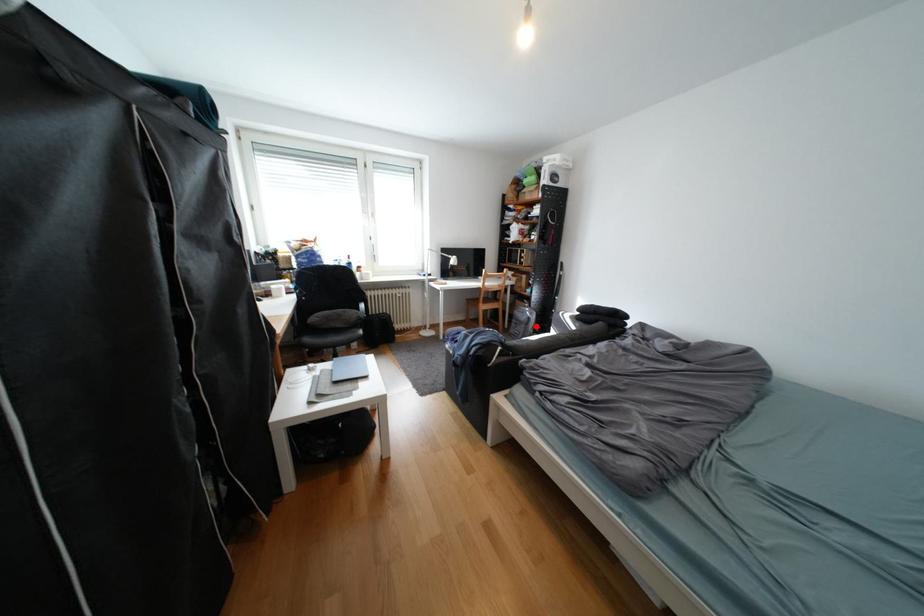
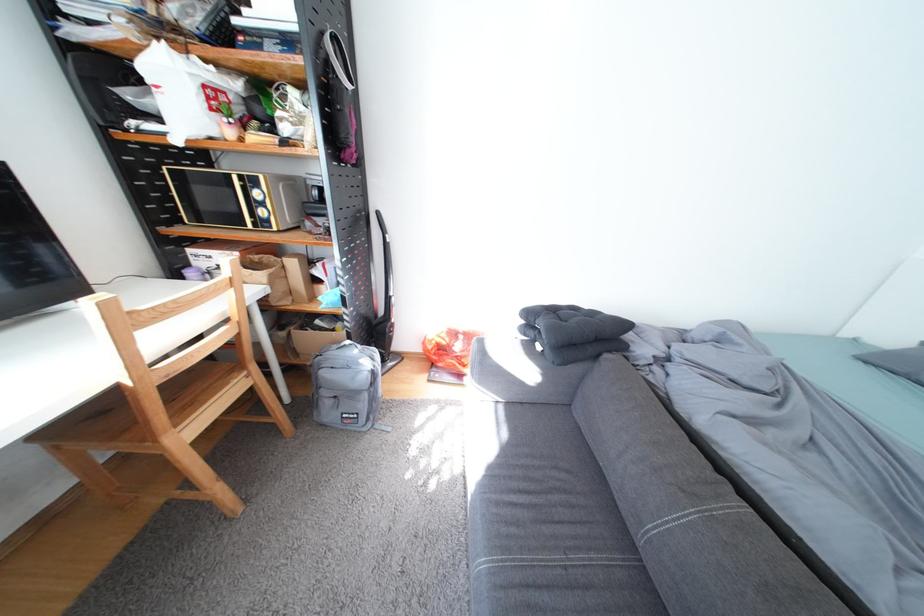
Question: I am providing you with two images of the same scene from different viewpoints. Image1 has a red point marked. In image2, the corresponding 3D location appears at what relative position? Reply with the corresponding letter.

Choices:
 (A) Closer
 (B) Farther

Answer: (A)